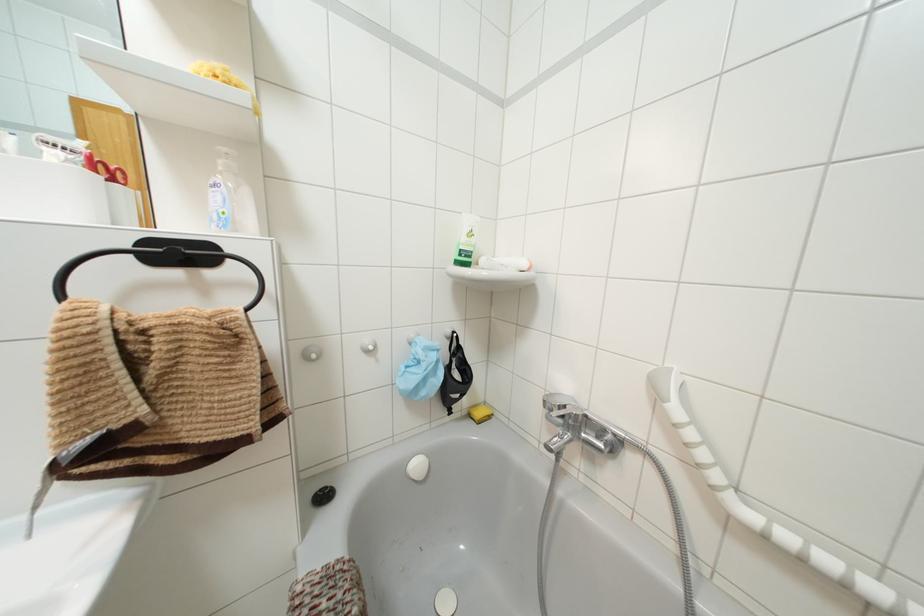
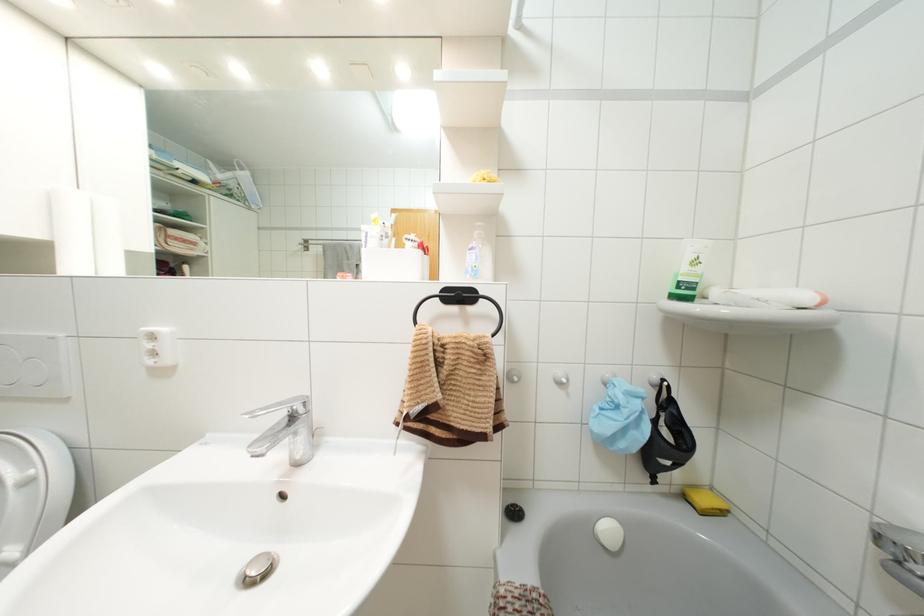
In the second image, find the point that corresponds to (x=468, y=416) in the first image.

(685, 496)